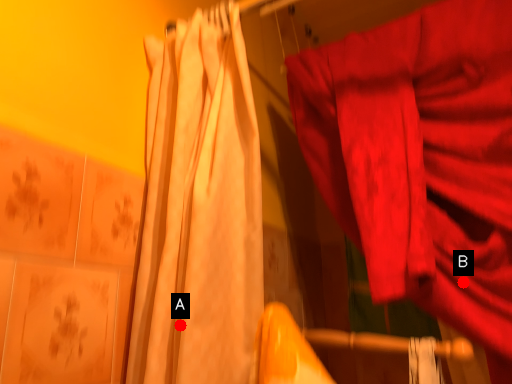
Question: Two points are circled on the image, labeled by A and B beside each circle. Which point is closer to the camera?

Choices:
 (A) A is closer
 (B) B is closer

Answer: (A)